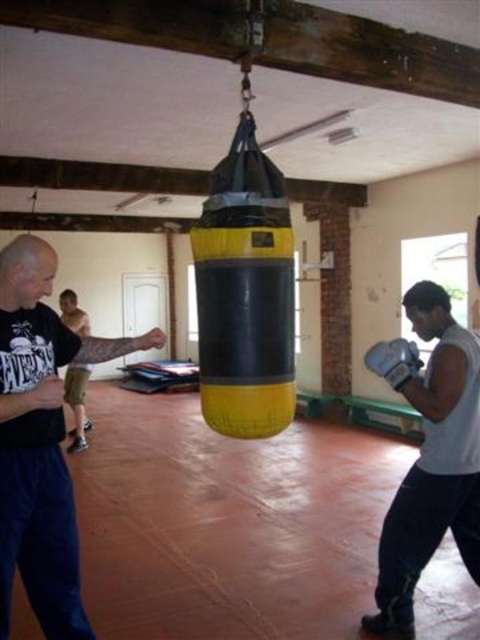
You are a gym trainer assessing the equipment and participants. You notice the matte black shirt at left and the white synthetic boxing glove at lower right. Which object is wider?

The matte black shirt at left is wider than the white synthetic boxing glove at lower right.

You are a photographer positioned at the back of the gym. You want to take a photo focusing on the white matte boxing gloves at center while ensuring the matte black shirt at left is also visible. Can you position yourself in a way that both objects are in the frame without moving either?

The matte black shirt at left is closer to the viewer than the white matte boxing gloves at center, so positioning yourself at the back allows both objects to be in the frame as the gloves are further away but still visible behind the shirt.

You are a photographer setting up a shoot in the gym. You need to position a spotlight so it illuminates both the matte black shirt at left and the white synthetic boxing glove at lower right. Given their sizes, which object requires a wider beam to cover adequately?

The matte black shirt at left requires a wider beam because it is larger in size than the white synthetic boxing glove at lower right.